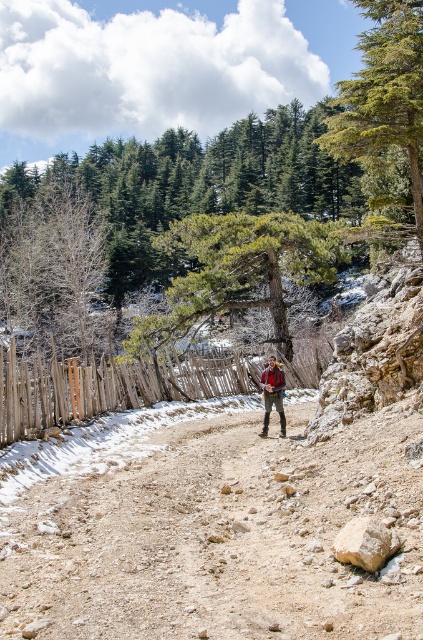
You are a hiker trying to decide whether to walk along the dusty gravel path at center or the green textured pine tree at center. Which one is narrower and thus easier to walk through?

The dusty gravel path at center has a smaller size compared to the green textured pine tree at center, so it is narrower and easier to walk through.

You are a hiker carrying a camouflage fabric backpack at center and want to take a photo of the green textured pine tree at center. Your camera has a maximum focus range of 25 meters. Will the tree be in focus?

The green textured pine tree at center is 26.53 meters away from the camouflage fabric backpack at center. Since the camera can only focus up to 25 meters, the tree is too far away to be in focus.